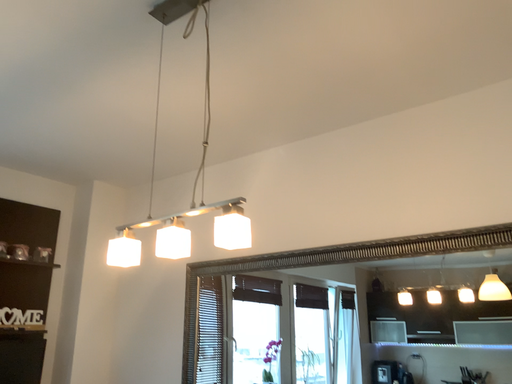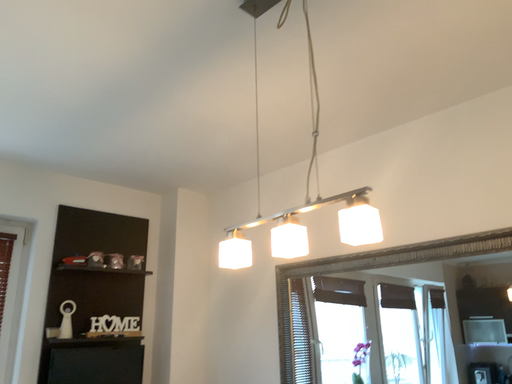
Question: Which way did the camera rotate in the video?

Choices:
 (A) rotated right
 (B) rotated left

Answer: (B)